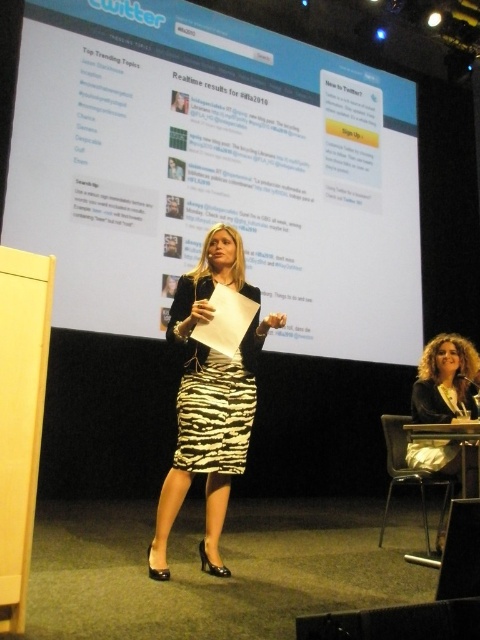
Looking at this image, who is shorter, white glossy projection screen at upper center or zebra print dress at center?

Standing shorter between the two is zebra print dress at center.

What do you see at coordinates (215, 172) in the screenshot? This screenshot has height=640, width=480. I see `white glossy projection screen at upper center` at bounding box center [215, 172].

Where is `white glossy projection screen at upper center`? The image size is (480, 640). white glossy projection screen at upper center is located at coordinates (215, 172).

Can you confirm if white glossy projection screen at upper center is shorter than curly hair at lower right?

In fact, white glossy projection screen at upper center may be taller than curly hair at lower right.

Between white glossy projection screen at upper center and curly hair at lower right, which one appears on the right side from the viewer's perspective?

Positioned to the right is curly hair at lower right.

Between point (120, 129) and point (456, 356), which one is positioned in front?

Point (456, 356)

In order to click on white glossy projection screen at upper center in this screenshot , I will do 215,172.

Which of these two, white glossy projection screen at upper center or zebra print skirt at center, stands shorter?

zebra print skirt at center

Between white glossy projection screen at upper center and zebra print skirt at center, which one appears on the left side from the viewer's perspective?

From the viewer's perspective, zebra print skirt at center appears more on the left side.

Where is `white glossy projection screen at upper center`? white glossy projection screen at upper center is located at coordinates (215, 172).